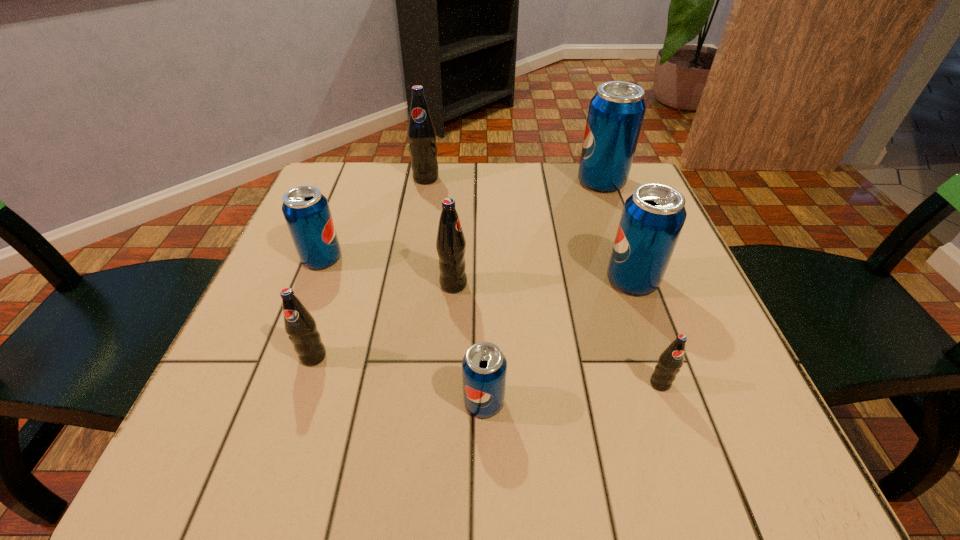
Where is `the biggest blue pop soda`? the biggest blue pop soda is located at coordinates (616, 112).

This screenshot has width=960, height=540. I want to click on the sixth pop from right to left, so click(421, 133).

Locate an element on the screen. The height and width of the screenshot is (540, 960). the farthest black pop is located at coordinates (421, 133).

I want to click on the second biggest blue pop soda, so click(652, 219).

This screenshot has height=540, width=960. Identify the location of the third smallest black pop. (450, 243).

This screenshot has width=960, height=540. I want to click on the second black pop from right to left, so click(450, 243).

You are a GUI agent. You are given a task and a screenshot of the screen. Output one action in this format:
    pyautogui.click(x=<x>, y=<y>)
    Task: Click on the third biggest blue pop soda
    The height and width of the screenshot is (540, 960).
    Given the screenshot: What is the action you would take?
    pyautogui.click(x=306, y=210)

Find the location of `the second smallest black pop`. the second smallest black pop is located at coordinates pyautogui.click(x=301, y=327).

This screenshot has height=540, width=960. What are the coordinates of `the second nearest black pop` in the screenshot? It's located at (301, 327).

This screenshot has height=540, width=960. I want to click on the nearest blue pop soda, so click(x=484, y=367).